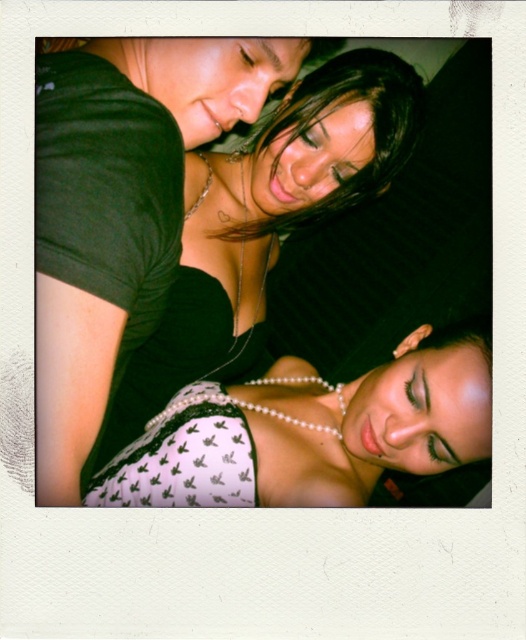
Consider the image. Which of these two, white lace bra at upper center or shiny black hair at upper center, stands taller?

Standing taller between the two is white lace bra at upper center.

Can you confirm if white lace bra at upper center is taller than shiny black hair at upper center?

Yes.

Which is behind, point (140, 417) or point (335, 92)?

Point (140, 417)

Locate an element on the screen. This screenshot has height=640, width=526. white lace bra at upper center is located at coordinates (265, 221).

Is point (337, 481) farther from camera compared to point (316, 179)?

No, (337, 481) is in front of (316, 179).

Is white lace top at lower center above white lace bra at upper center?

Actually, white lace top at lower center is below white lace bra at upper center.

Between point (286, 440) and point (333, 60), which one is positioned behind?

Point (333, 60)

Find the location of a particular element. The height and width of the screenshot is (640, 526). white lace top at lower center is located at coordinates (312, 429).

Between point (490, 348) and point (305, 81), which one is positioned in front?

Positioned in front is point (490, 348).

Between white lace top at lower center and shiny black hair at upper center, which one has more height?

With more height is shiny black hair at upper center.

Between point (310, 458) and point (317, 88), which one is positioned behind?

Point (317, 88)

You are a GUI agent. You are given a task and a screenshot of the screen. Output one action in this format:
    pyautogui.click(x=<x>, y=<y>)
    Task: Click on the white lace top at lower center
    
    Given the screenshot: What is the action you would take?
    pyautogui.click(x=312, y=429)